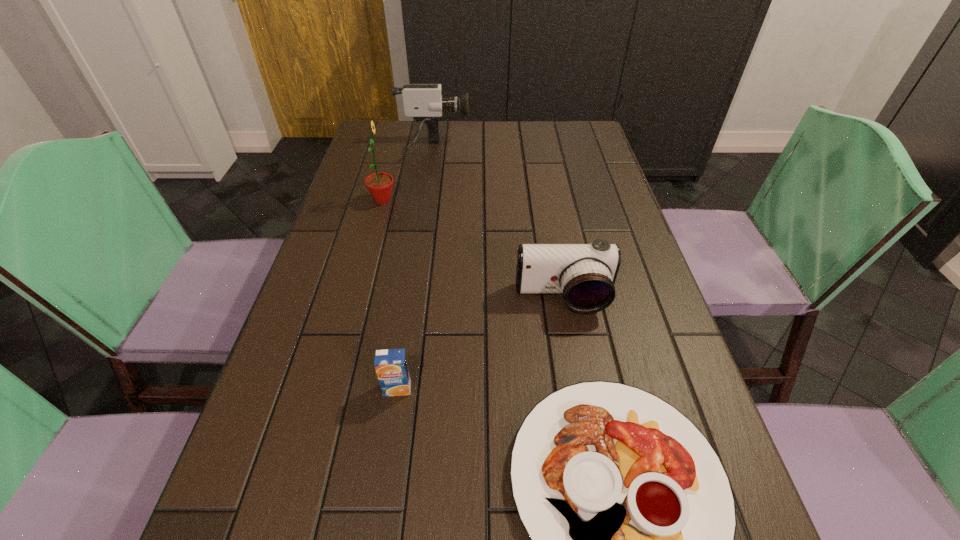
Where is `vacant space situated 0.200m on the left of the orange_juice`? The width and height of the screenshot is (960, 540). vacant space situated 0.200m on the left of the orange_juice is located at coordinates (274, 388).

The width and height of the screenshot is (960, 540). I want to click on object that is positioned at the far edge, so click(424, 102).

Where is `sunflower present at the left edge`? The width and height of the screenshot is (960, 540). sunflower present at the left edge is located at coordinates (379, 185).

Where is `camcorder that is at the left edge`? The height and width of the screenshot is (540, 960). camcorder that is at the left edge is located at coordinates [x=424, y=102].

Find the location of a particular element. This screenshot has height=540, width=960. object located in the right edge section of the desktop is located at coordinates (585, 274).

At what (x,y) coordinates should I click in order to perform the action: click on object that is positioned at the far left corner. Please return your answer as a coordinate pair (x, y). This screenshot has height=540, width=960. Looking at the image, I should click on (424, 102).

The image size is (960, 540). Find the location of `vacant space at the far edge`. vacant space at the far edge is located at coordinates (427, 147).

This screenshot has height=540, width=960. I want to click on blank area at the left edge, so coord(341,267).

The width and height of the screenshot is (960, 540). Find the location of `vacant space at the right edge`. vacant space at the right edge is located at coordinates (588, 175).

Image resolution: width=960 pixels, height=540 pixels. In the image, there is a desktop. Identify the location of vacant space at the far left corner. (399, 129).